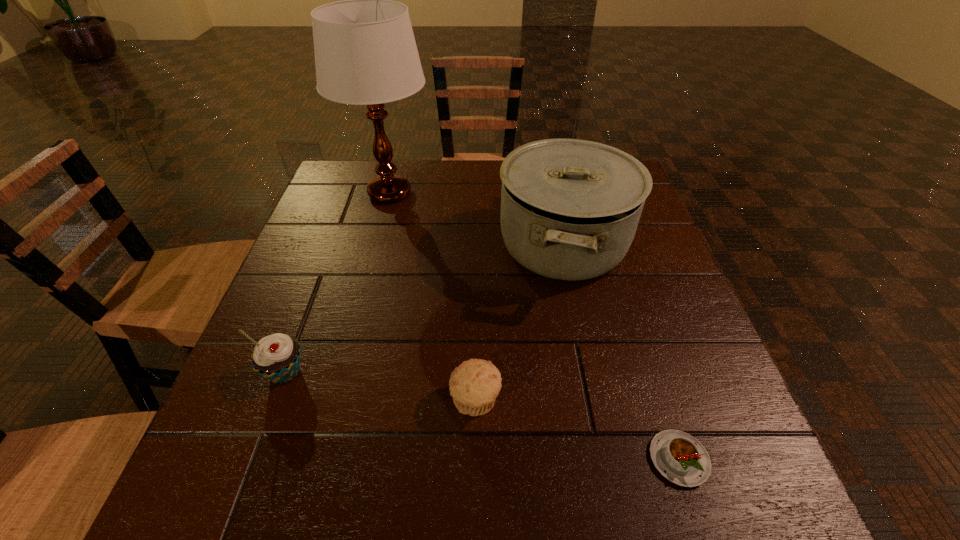
I want to click on free location that satisfies the following two spatial constraints: 1. on the front side of the table lamp; 2. on the right side of the saucepan, so [x=376, y=245].

The width and height of the screenshot is (960, 540). I want to click on free spot that satisfies the following two spatial constraints: 1. on the front side of the fourth shortest object; 2. on the left side of the nearest object, so 609,459.